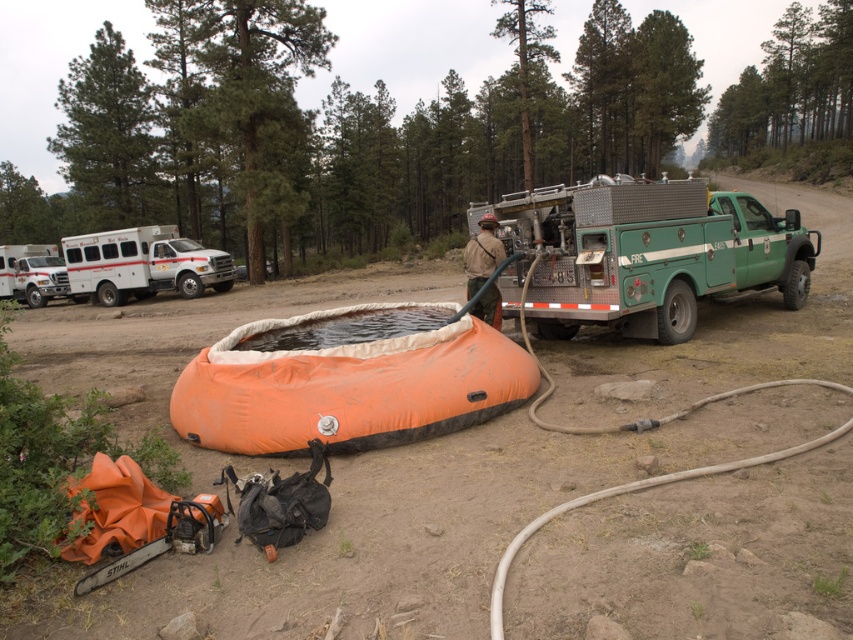
You are standing at the point labeled point (167, 257) and want to walk towards the point labeled point (61, 269). Which direction should you move to get closer to your destination?

Since point (167, 257) is closer to the viewer than point (61, 269), you should move forward towards the point labeled point (61, 269) to get closer to your destination.